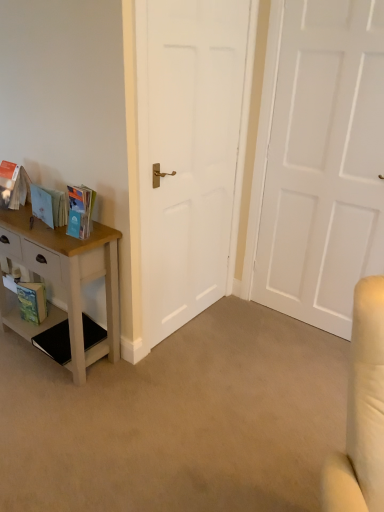
Where is `vacant space to the right of white matte door at center, which is counted as the 1th door, starting from the left`? The height and width of the screenshot is (512, 384). vacant space to the right of white matte door at center, which is counted as the 1th door, starting from the left is located at coordinates (228, 321).